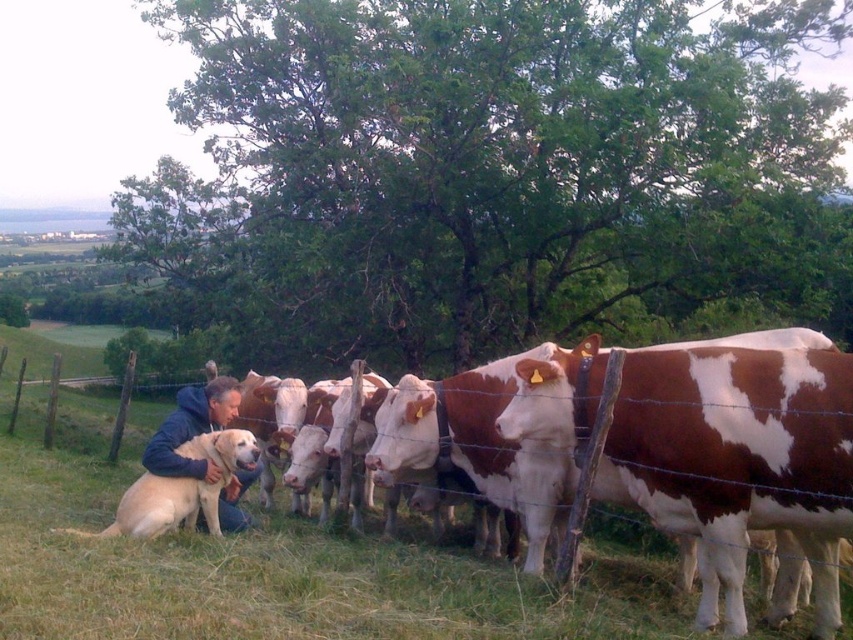
Question: Which object is closer to the camera taking this photo?

Choices:
 (A) golden fur dog at lower left
 (B) golden fur dog at center

Answer: (A)

Question: Among these objects, which one is farthest from the camera?

Choices:
 (A) golden fur dog at lower left
 (B) golden fur dog at center

Answer: (B)

Question: Which object appears closest to the camera in this image?

Choices:
 (A) golden fur dog at lower left
 (B) golden fur dog at center

Answer: (A)

Question: Is golden fur dog at lower left above golden fur dog at center?

Choices:
 (A) no
 (B) yes

Answer: (A)

Question: Can you confirm if golden fur dog at lower left is positioned to the right of golden fur dog at center?

Choices:
 (A) yes
 (B) no

Answer: (B)

Question: Does golden fur dog at lower left appear under golden fur dog at center?

Choices:
 (A) no
 (B) yes

Answer: (B)